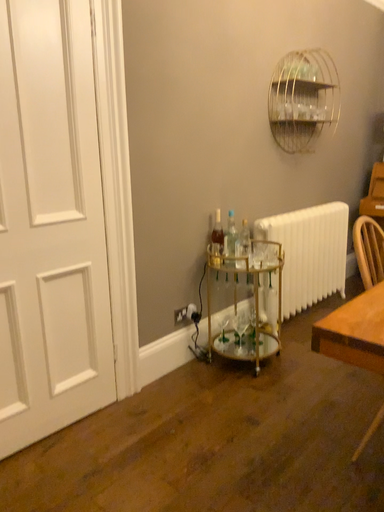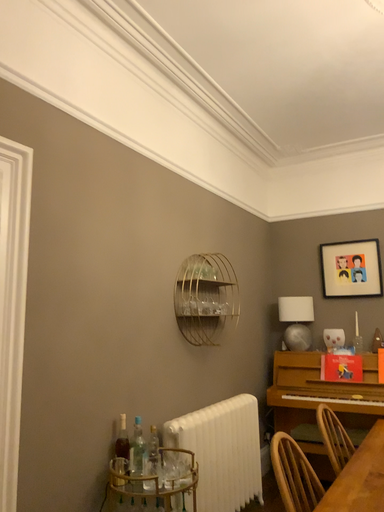
Question: How did the camera likely rotate when shooting the video?

Choices:
 (A) rotated left
 (B) rotated right

Answer: (B)